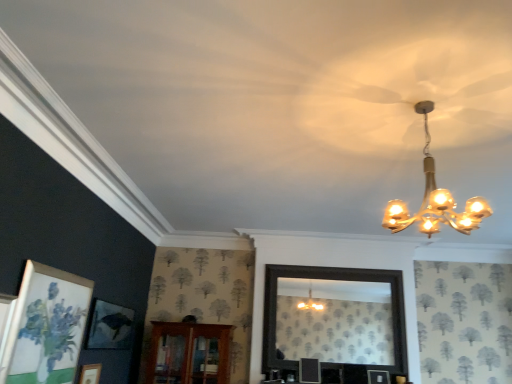
Where is `brown wooden cabinet at center`? The image size is (512, 384). brown wooden cabinet at center is located at coordinates (189, 353).

Where is `matte white picture frame at lower left`? This screenshot has width=512, height=384. matte white picture frame at lower left is located at coordinates (90, 374).

Could you tell me if matte white picture frame at lower left is facing brown wooden cabinet at center?

No, matte white picture frame at lower left is not aimed at brown wooden cabinet at center.

Identify the location of picture frame on the left side of brown wooden cabinet at center. (90, 374).

Which is behind, point (98, 380) or point (205, 347)?

The point (205, 347) is farther.

Do you think brown wooden cabinet at center is within gold glass chandelier at upper right, or outside of it?

brown wooden cabinet at center exists outside the volume of gold glass chandelier at upper right.

From a real-world perspective, which object stands above the other?

gold glass chandelier at upper right is physically above.

Considering the positions of points (176, 345) and (451, 194), is point (176, 345) farther from camera compared to point (451, 194)?

Yes, it is.

Identify the location of lamp located in front of the matte white picture frame at lower left. This screenshot has height=384, width=512. (435, 199).

Based on their sizes in the image, would you say matte white picture frame at lower left is bigger or smaller than gold glass chandelier at upper right?

Clearly, matte white picture frame at lower left is smaller in size than gold glass chandelier at upper right.

Are matte white picture frame at lower left and gold glass chandelier at upper right far apart?

Yes, matte white picture frame at lower left and gold glass chandelier at upper right are quite far apart.

Consider the image. From a real-world perspective, is matte white picture frame at lower left located higher than gold glass chandelier at upper right?

Incorrect, from a real-world perspective, matte white picture frame at lower left is lower than gold glass chandelier at upper right.

Based on the photo, from the image's perspective, is gold glass chandelier at upper right above or below matte white picture frame at lower left?

gold glass chandelier at upper right is above matte white picture frame at lower left.

Which object is closer to the camera, gold glass chandelier at upper right or matte white picture frame at lower left?

gold glass chandelier at upper right is more forward.

Does gold glass chandelier at upper right have a lesser width compared to matte white picture frame at lower left?

No, gold glass chandelier at upper right is not thinner than matte white picture frame at lower left.

Considering the relative positions of gold glass chandelier at upper right and matte white picture frame at lower left in the image provided, is gold glass chandelier at upper right to the left or to the right of matte white picture frame at lower left?

In the image, gold glass chandelier at upper right appears on the right side of matte white picture frame at lower left.

Is the position of gold glass chandelier at upper right less distant than that of brown wooden cabinet at center?

Yes, gold glass chandelier at upper right is in front of brown wooden cabinet at center.

How distant is gold glass chandelier at upper right from brown wooden cabinet at center?

gold glass chandelier at upper right and brown wooden cabinet at center are 2.94 meters apart.

What's the angular difference between gold glass chandelier at upper right and brown wooden cabinet at center's facing directions?

gold glass chandelier at upper right and brown wooden cabinet at center are facing 91.4 degrees away from each other.

Is gold glass chandelier at upper right not within brown wooden cabinet at center?

That's correct, gold glass chandelier at upper right is outside of brown wooden cabinet at center.

Does brown wooden cabinet at center have a smaller size compared to matte white picture frame at lower left?

Actually, brown wooden cabinet at center might be larger than matte white picture frame at lower left.

Is brown wooden cabinet at center to the left or to the right of matte white picture frame at lower left in the image?

brown wooden cabinet at center is positioned on matte white picture frame at lower left's right side.

From a real-world perspective, is brown wooden cabinet at center physically below matte white picture frame at lower left?

Incorrect, from a real-world perspective, brown wooden cabinet at center is higher than matte white picture frame at lower left.

Is brown wooden cabinet at center not within matte white picture frame at lower left?

brown wooden cabinet at center lies outside matte white picture frame at lower left's area.

At what (x,y) coordinates should I click in order to perform the action: click on picture frame below the brown wooden cabinet at center (from a real-world perspective). Please return your answer as a coordinate pair (x, y). This screenshot has height=384, width=512. Looking at the image, I should click on (90, 374).

Identify the location of lamp located above the brown wooden cabinet at center (from a real-world perspective). The width and height of the screenshot is (512, 384). (435, 199).

From the image, which object appears to be farther from matte white picture frame at lower left, brown wooden cabinet at center or gold glass chandelier at upper right?

gold glass chandelier at upper right lies further to matte white picture frame at lower left than the other object.

Considering their positions, is gold glass chandelier at upper right positioned further to brown wooden cabinet at center than matte white picture frame at lower left?

gold glass chandelier at upper right.

Based on the photo, which object lies nearer to the anchor point gold glass chandelier at upper right, matte white picture frame at lower left or brown wooden cabinet at center?

Based on the image, brown wooden cabinet at center appears to be nearer to gold glass chandelier at upper right.

Which object lies nearer to the anchor point brown wooden cabinet at center, matte white picture frame at lower left or gold glass chandelier at upper right?

matte white picture frame at lower left lies closer to brown wooden cabinet at center than the other object.

Estimate the real-world distances between objects in this image. Which object is further from matte white picture frame at lower left, gold glass chandelier at upper right or brown wooden cabinet at center?

gold glass chandelier at upper right lies further to matte white picture frame at lower left than the other object.

Estimate the real-world distances between objects in this image. Which object is further from gold glass chandelier at upper right, brown wooden cabinet at center or matte white picture frame at lower left?

Based on the image, matte white picture frame at lower left appears to be further to gold glass chandelier at upper right.

Where is `picture frame between gold glass chandelier at upper right and brown wooden cabinet at center along the z-axis`? This screenshot has width=512, height=384. picture frame between gold glass chandelier at upper right and brown wooden cabinet at center along the z-axis is located at coordinates (90, 374).